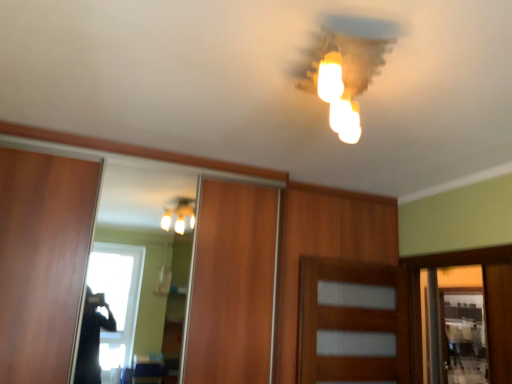
Image resolution: width=512 pixels, height=384 pixels. What do you see at coordinates (343, 75) in the screenshot?
I see `matte white light fixture at upper center` at bounding box center [343, 75].

Where is `matte white light fixture at upper center`? The height and width of the screenshot is (384, 512). matte white light fixture at upper center is located at coordinates (343, 75).

In order to face matte white light fixture at upper center, should I rotate leftwards or rightwards?

Turn right by 10.972 degrees to look at matte white light fixture at upper center.

Find the location of `wooden door at center`. wooden door at center is located at coordinates click(x=351, y=321).

The height and width of the screenshot is (384, 512). Describe the element at coordinates (351, 321) in the screenshot. I see `wooden door at center` at that location.

You are a GUI agent. You are given a task and a screenshot of the screen. Output one action in this format:
    pyautogui.click(x=<x>, y=<y>)
    Task: Click on the matte white light fixture at upper center
    The height and width of the screenshot is (384, 512).
    Given the screenshot: What is the action you would take?
    pyautogui.click(x=343, y=75)

Considering the positions of objects matte white light fixture at upper center and wooden door at center in the image provided, who is more to the right, matte white light fixture at upper center or wooden door at center?

Positioned to the right is wooden door at center.

Relative to wooden door at center, is matte white light fixture at upper center in front or behind?

Visually, matte white light fixture at upper center is located in front of wooden door at center.

Is point (353, 63) closer to viewer compared to point (339, 294)?

Yes, it is in front of point (339, 294).

From the image's perspective, relative to wooden door at center, is matte white light fixture at upper center above or below?

matte white light fixture at upper center is above wooden door at center.

From a real-world perspective, between matte white light fixture at upper center and wooden door at center, who is vertically lower?

In real-world perspective, wooden door at center is lower.

Which object is wider, matte white light fixture at upper center or wooden door at center?

matte white light fixture at upper center is wider.

Considering the sizes of matte white light fixture at upper center and wooden door at center in the image, is matte white light fixture at upper center taller or shorter than wooden door at center?

Considering their sizes, matte white light fixture at upper center has less height than wooden door at center.

Who is bigger, matte white light fixture at upper center or wooden door at center?

wooden door at center is bigger.

Can wooden door at center be found inside matte white light fixture at upper center?

No, wooden door at center is located outside of matte white light fixture at upper center.

Is matte white light fixture at upper center beside wooden door at center?

matte white light fixture at upper center and wooden door at center are not in contact.

Is matte white light fixture at upper center turned away from wooden door at center?

No.

What are the coordinates of `lamp above the wooden door at center (from a real-world perspective)` in the screenshot? It's located at (343, 75).

Is wooden door at center to the left of matte white light fixture at upper center from the viewer's perspective?

In fact, wooden door at center is to the right of matte white light fixture at upper center.

Which object is closer to the camera taking this photo, wooden door at center or matte white light fixture at upper center?

Positioned in front is matte white light fixture at upper center.

Which is behind, point (364, 280) or point (333, 125)?

Point (364, 280)

From the image's perspective, which object appears higher, wooden door at center or matte white light fixture at upper center?

matte white light fixture at upper center.

From a real-world perspective, which is physically above, wooden door at center or matte white light fixture at upper center?

matte white light fixture at upper center.

Looking at this image, looking at their sizes, would you say wooden door at center is wider or thinner than matte white light fixture at upper center?

In the image, wooden door at center appears to be more narrow than matte white light fixture at upper center.

In the scene shown: Does wooden door at center have a lesser height compared to matte white light fixture at upper center?

Incorrect, the height of wooden door at center does not fall short of that of matte white light fixture at upper center.

From the picture: Is wooden door at center bigger than matte white light fixture at upper center?

Yes, wooden door at center is bigger than matte white light fixture at upper center.

Choose the correct answer: Is wooden door at center inside matte white light fixture at upper center or outside it?

wooden door at center is not enclosed by matte white light fixture at upper center.

Is wooden door at center next to matte white light fixture at upper center?

No.

Is wooden door at center facing towards matte white light fixture at upper center?

No.

How different are the orientations of wooden door at center and matte white light fixture at upper center in degrees?

wooden door at center and matte white light fixture at upper center are facing 69.5 degrees away from each other.

Locate an element on the screen. This screenshot has width=512, height=384. door below the matte white light fixture at upper center (from the image's perspective) is located at coordinates (351, 321).

Locate an element on the screen. lamp that appears on the left of wooden door at center is located at coordinates (343, 75).

I want to click on door on the right of matte white light fixture at upper center, so click(x=351, y=321).